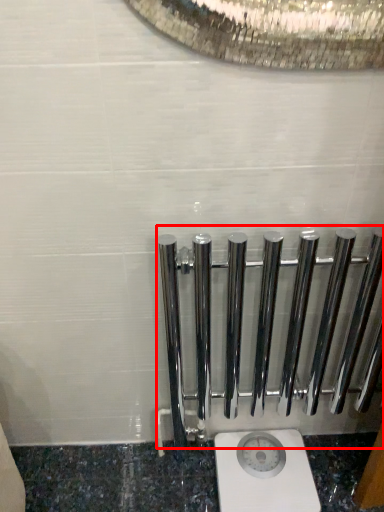
Question: From the image's perspective, where is rail (annotated by the red box) located relative to toilet?

Choices:
 (A) above
 (B) below

Answer: (A)